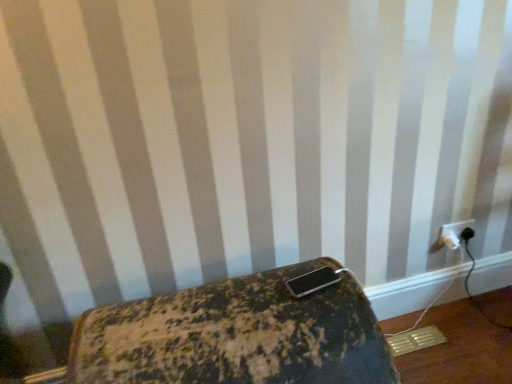
Question: Considering the relative sizes of rusty metal suitcase at lower center and white plastic power plugs and sockets at lower right in the image provided, is rusty metal suitcase at lower center bigger than white plastic power plugs and sockets at lower right?

Choices:
 (A) no
 (B) yes

Answer: (B)

Question: From a real-world perspective, is rusty metal suitcase at lower center positioned under white plastic power plugs and sockets at lower right based on gravity?

Choices:
 (A) yes
 (B) no

Answer: (A)

Question: Is rusty metal suitcase at lower center far away from white plastic power plugs and sockets at lower right?

Choices:
 (A) no
 (B) yes

Answer: (B)

Question: Is rusty metal suitcase at lower center looking in the opposite direction of white plastic power plugs and sockets at lower right?

Choices:
 (A) no
 (B) yes

Answer: (A)

Question: Is the position of rusty metal suitcase at lower center more distant than that of white plastic power plugs and sockets at lower right?

Choices:
 (A) no
 (B) yes

Answer: (A)

Question: Is rusty metal suitcase at lower center oriented towards white plastic power plugs and sockets at lower right?

Choices:
 (A) yes
 (B) no

Answer: (B)

Question: Does white plastic power plugs and sockets at lower right have a smaller size compared to rusty metal suitcase at lower center?

Choices:
 (A) yes
 (B) no

Answer: (A)

Question: Could you tell me if white plastic power plugs and sockets at lower right is turned towards rusty metal suitcase at lower center?

Choices:
 (A) yes
 (B) no

Answer: (B)

Question: Is white plastic power plugs and sockets at lower right shorter than rusty metal suitcase at lower center?

Choices:
 (A) no
 (B) yes

Answer: (B)

Question: Considering the relative positions of white plastic power plugs and sockets at lower right and rusty metal suitcase at lower center in the image provided, is white plastic power plugs and sockets at lower right behind rusty metal suitcase at lower center?

Choices:
 (A) no
 (B) yes

Answer: (B)

Question: Does white plastic power plugs and sockets at lower right have a greater height compared to rusty metal suitcase at lower center?

Choices:
 (A) yes
 (B) no

Answer: (B)

Question: Is white plastic power plugs and sockets at lower right completely or partially outside of rusty metal suitcase at lower center?

Choices:
 (A) yes
 (B) no

Answer: (A)

Question: Which is correct: white plastic power plugs and sockets at lower right is inside rusty metal suitcase at lower center, or outside of it?

Choices:
 (A) outside
 (B) inside

Answer: (A)